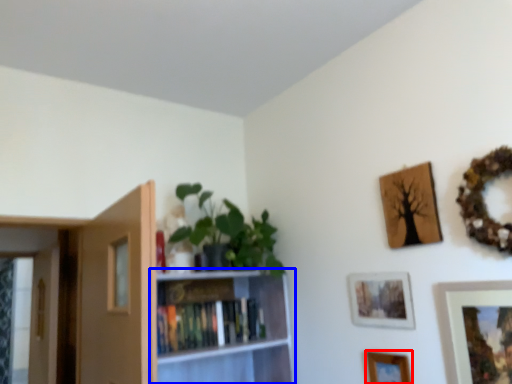
Question: Which of the following is the farthest to the observer, picture frame (highlighted by a red box) or bookcase (highlighted by a blue box)?

Choices:
 (A) picture frame
 (B) bookcase

Answer: (B)